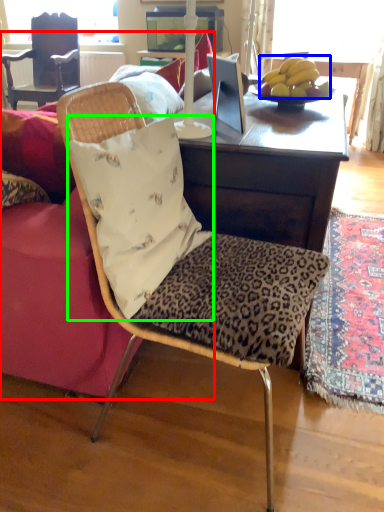
Question: Which object is positioned farthest from studio couch (highlighted by a red box)? Select from banana (highlighted by a blue box) and pillow (highlighted by a green box).

Choices:
 (A) banana
 (B) pillow

Answer: (A)